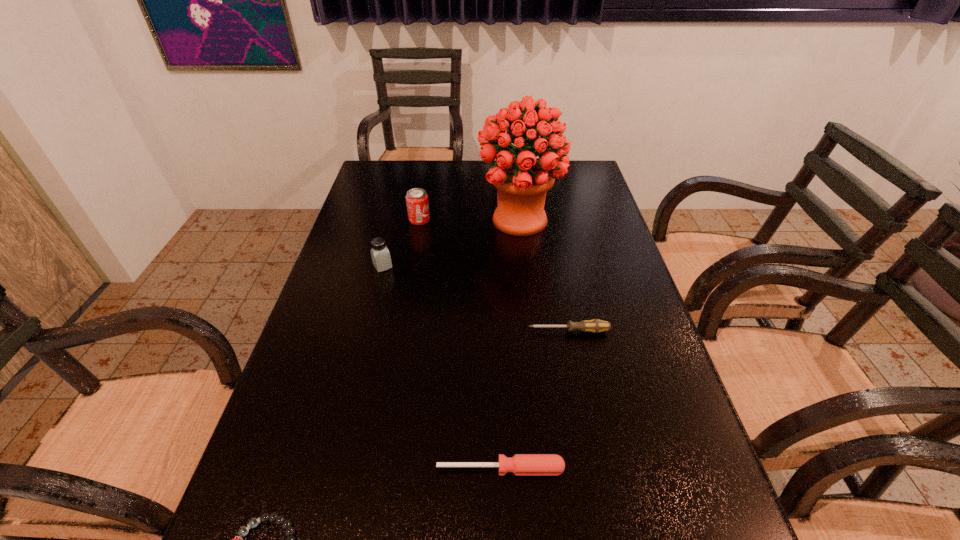
At what (x,y) coordinates should I click in order to perform the action: click on free point located 0.110m at the tip of the farther screwdriver. Please return your answer as a coordinate pair (x, y). This screenshot has width=960, height=540. Looking at the image, I should click on (483, 331).

Where is `vacant point located 0.230m on the right of the second nearest object`? The height and width of the screenshot is (540, 960). vacant point located 0.230m on the right of the second nearest object is located at coordinates (688, 469).

I want to click on object that is at the left edge, so click(x=381, y=259).

You are a GUI agent. You are given a task and a screenshot of the screen. Output one action in this format:
    pyautogui.click(x=<x>, y=<y>)
    Task: Click on the bouquet that is positioned at the right edge
    Image resolution: width=960 pixels, height=540 pixels.
    Given the screenshot: What is the action you would take?
    pyautogui.click(x=522, y=180)

Where is `screwdriver that is positioned at the right edge`? The image size is (960, 540). screwdriver that is positioned at the right edge is located at coordinates (595, 325).

You are a GUI agent. You are given a task and a screenshot of the screen. Output one action in this format:
    pyautogui.click(x=<x>, y=<y>)
    Task: Click on the free space at the far edge
    
    Given the screenshot: What is the action you would take?
    pyautogui.click(x=417, y=185)

Find the location of a particular element. vacant point at the left edge is located at coordinates (401, 218).

In the image, there is a desktop. At what (x,y) coordinates should I click in order to perform the action: click on vacant area at the right edge. Please return your answer as a coordinate pair (x, y). Looking at the image, I should click on tap(591, 242).

Identify the location of vacant region at the far right corner. Image resolution: width=960 pixels, height=540 pixels. (577, 169).

At what (x,y) coordinates should I click in order to perform the action: click on vacant space in between the third object from left to right and the farther screwdriver. Please return your answer as a coordinate pair (x, y). Looking at the image, I should click on (494, 275).